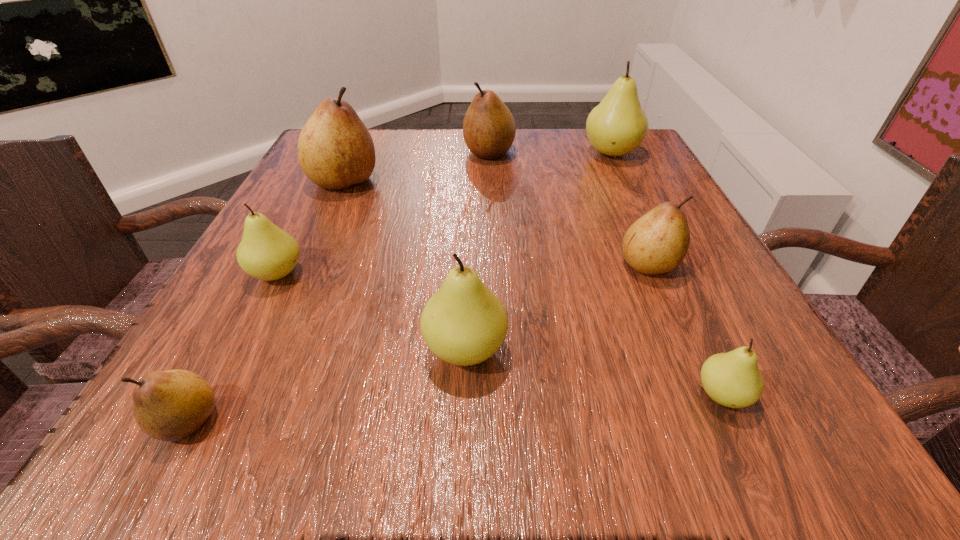
Identify which green pear is located as the third nearest to the biggest brown pear. Please provide its 2D coordinates. Your answer should be formatted as a tuple, i.e. [(x, y)], where the tuple contains the x and y coordinates of a point satisfying the conditions above.

[(618, 125)]

Identify which green pear is the second closest to the nearest brown pear. Please provide its 2D coordinates. Your answer should be formatted as a tuple, i.e. [(x, y)], where the tuple contains the x and y coordinates of a point satisfying the conditions above.

[(464, 323)]

Where is `the closest brown pear relative to the third brown pear from left to right`? The width and height of the screenshot is (960, 540). the closest brown pear relative to the third brown pear from left to right is located at coordinates (335, 150).

The image size is (960, 540). In order to click on brown pear that is the closest one to the rightmost brown pear in this screenshot , I will do `click(489, 128)`.

Find the location of a particular element. The width and height of the screenshot is (960, 540). free spot that satisfies the following two spatial constraints: 1. on the back side of the second brown pear from right to left; 2. on the right side of the third green pear from right to left is located at coordinates (471, 152).